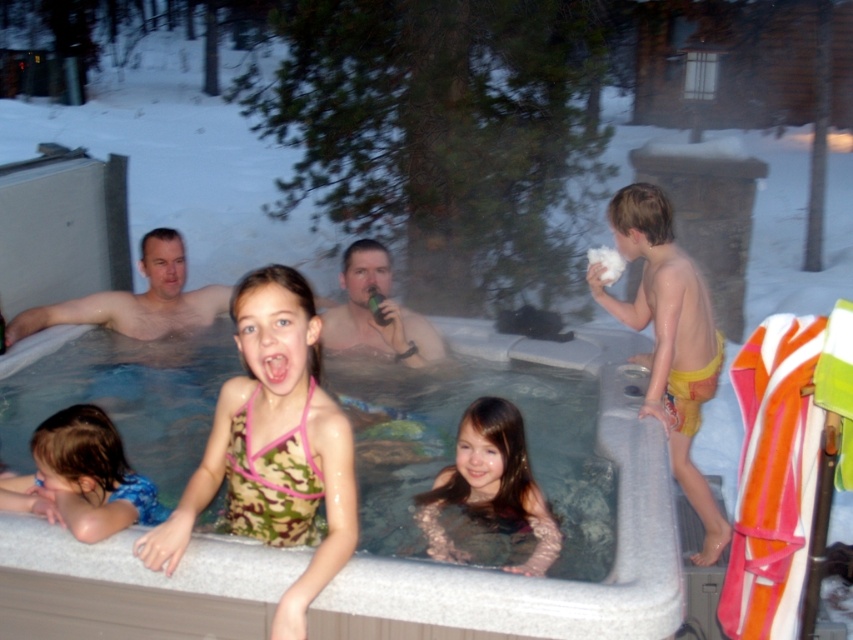
You are a photographer standing at the edge of the hot tub. You want to take a photo that includes both the smooth pink swimsuit at center and the smooth skin man at left. Given that your camera has a maximum focus range of 10 feet, will you be able to capture both subjects clearly in the same frame?

The distance between the smooth pink swimsuit at center and the smooth skin man at left is 8.29 feet, which is within the camera maximum focus range of 10 feet. Therefore, you can capture both subjects clearly in the same frame.